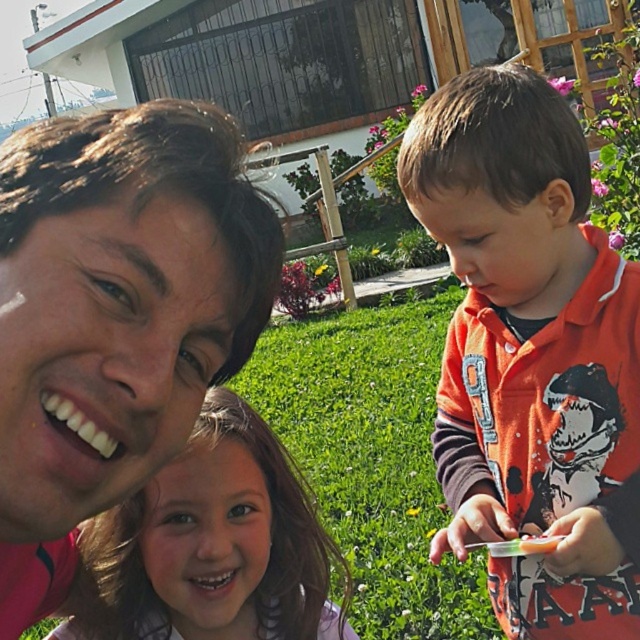
Question: Which is nearer to the smooth brown hair at lower center?

Choices:
 (A) matte pink shirt at upper left
 (B) orange fleece jacket at right

Answer: (A)

Question: Is matte pink shirt at upper left behind orange fleece jacket at right?

Choices:
 (A) no
 (B) yes

Answer: (A)

Question: Considering the real-world distances, which object is closest to the smooth brown hair at lower center?

Choices:
 (A) matte pink shirt at upper left
 (B) orange fleece jacket at right

Answer: (A)

Question: Does matte pink shirt at upper left appear on the right side of smooth brown hair at lower center?

Choices:
 (A) yes
 (B) no

Answer: (B)

Question: Is the position of matte pink shirt at upper left more distant than that of smooth brown hair at lower center?

Choices:
 (A) no
 (B) yes

Answer: (A)

Question: Which point is farther to the camera?

Choices:
 (A) (218, 625)
 (B) (1, 323)
 (C) (490, 579)

Answer: (C)